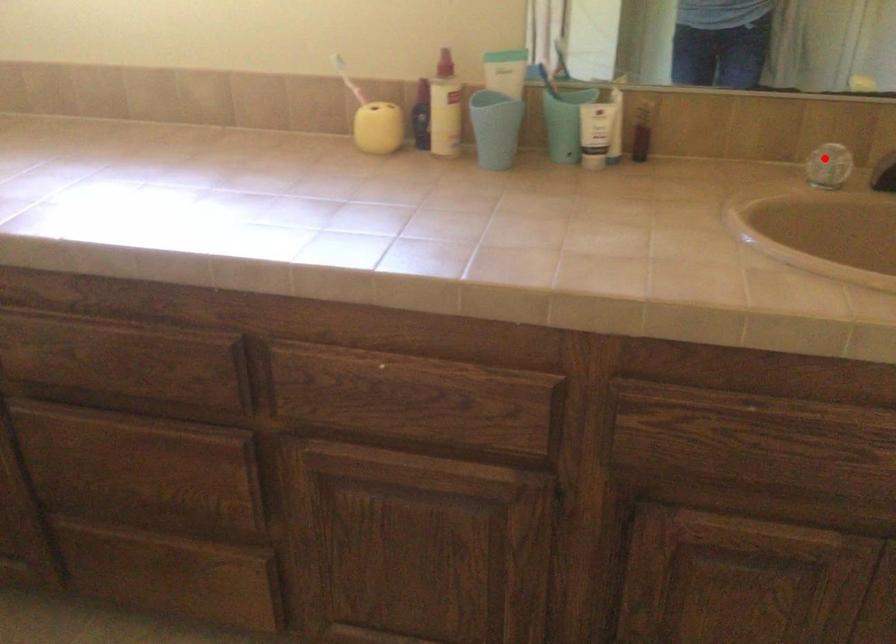
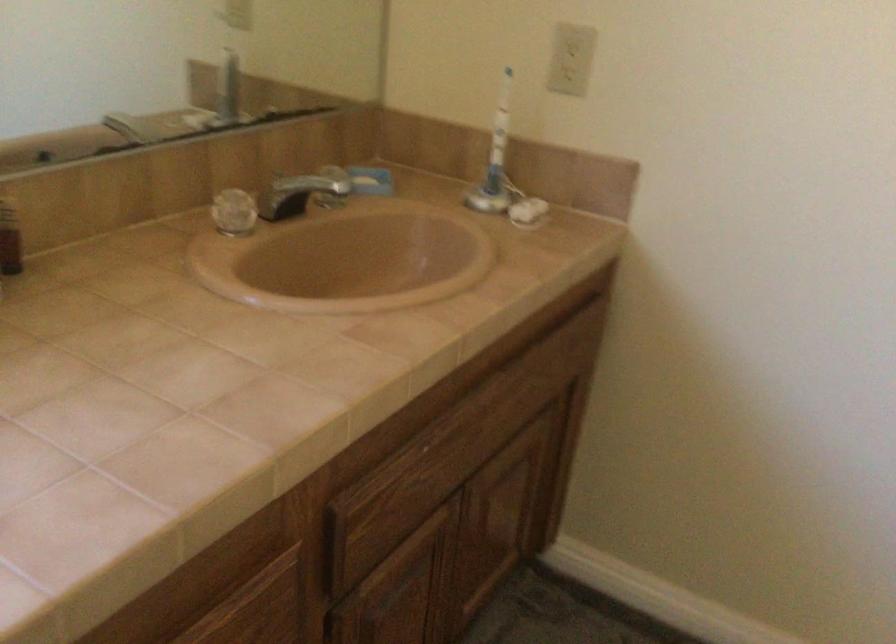
Find the pixel in the second image that matches the highlighted location in the first image.

(234, 212)